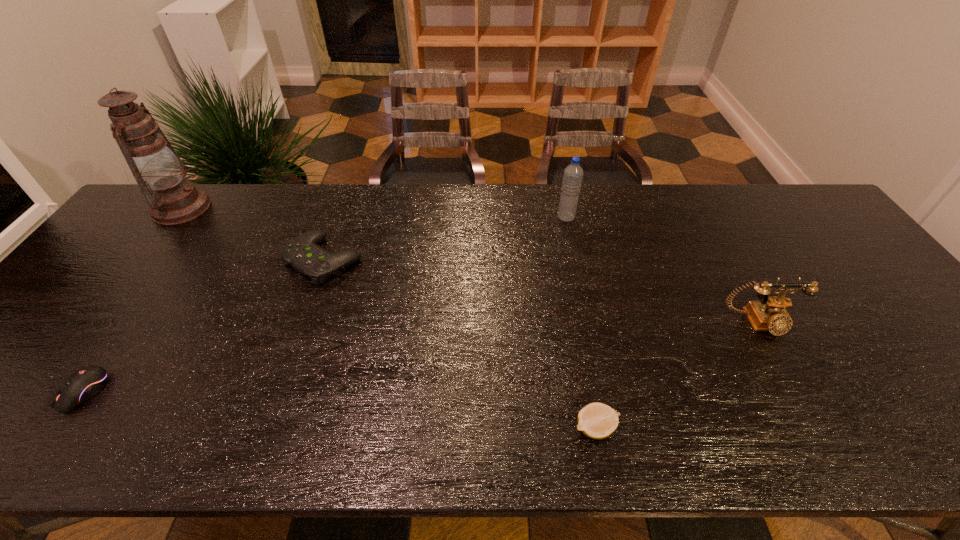
Find the location of a particular element. free space at the far edge of the desktop is located at coordinates (388, 197).

Locate an element on the screen. The image size is (960, 540). free region at the left edge is located at coordinates click(x=117, y=306).

The image size is (960, 540). Identify the location of vacant space at the right edge of the desktop. (890, 337).

Where is `empty space that is in between the water bottle and the third nearest object`? The image size is (960, 540). empty space that is in between the water bottle and the third nearest object is located at coordinates pyautogui.click(x=662, y=270).

The width and height of the screenshot is (960, 540). What are the coordinates of `free space between the oil lamp and the third farthest object` in the screenshot? It's located at (252, 234).

Where is `vacant area between the fourth nearest object and the telephone`? vacant area between the fourth nearest object and the telephone is located at coordinates (540, 291).

Identify the location of unoccupied area between the tallest object and the lemon. (389, 318).

Locate an element on the screen. This screenshot has width=960, height=540. free space that is in between the oil lamp and the water bottle is located at coordinates (373, 213).

Find the location of a particular element. This screenshot has height=540, width=960. free point between the tallest object and the lemon is located at coordinates (389, 318).

Locate an element on the screen. empty location between the computer mouse and the tallest object is located at coordinates (132, 300).